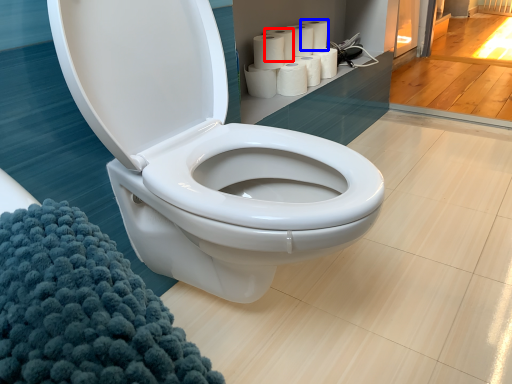
Question: Among these objects, which one is nearest to the camera, paper towel (highlighted by a red box) or toilet paper (highlighted by a blue box)?

Choices:
 (A) paper towel
 (B) toilet paper

Answer: (A)